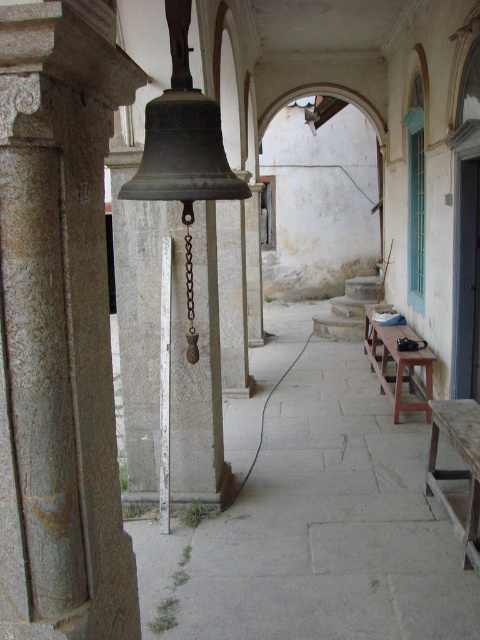
Who is more distant from viewer, (x=73, y=38) or (x=376, y=356)?

The point (x=376, y=356) is behind.

The image size is (480, 640). Find the location of `gray stone pillar at center`. gray stone pillar at center is located at coordinates (59, 326).

Which of these two, gray stone pillar at center or smooth stone alley at center, stands taller?

Standing taller between the two is gray stone pillar at center.

Is point (28, 529) closer to viewer compared to point (312, 428)?

Yes, it is.

The width and height of the screenshot is (480, 640). What are the coordinates of `gray stone pillar at center` in the screenshot? It's located at (59, 326).

Locate an element on the screen. This screenshot has width=480, height=640. smooth stone alley at center is located at coordinates (312, 513).

Does point (373, 545) come behind point (398, 408)?

That is False.

At what (x,y) coordinates should I click in order to perform the action: click on smooth stone alley at center. Please return your answer as a coordinate pair (x, y). The height and width of the screenshot is (640, 480). Looking at the image, I should click on (312, 513).

The image size is (480, 640). In order to click on smooth stone alley at center in this screenshot , I will do `click(312, 513)`.